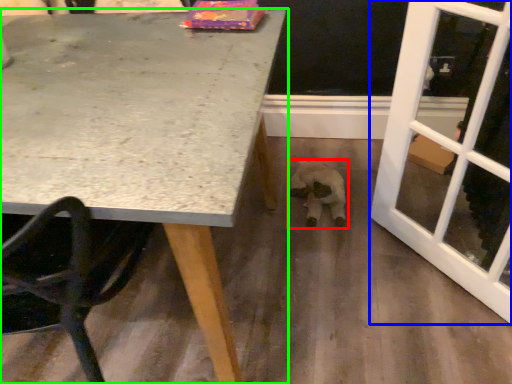
Question: Which object is positioned closest to animal (highlighted by a red box)? Select from screen door (highlighted by a blue box) and table (highlighted by a green box).

Choices:
 (A) screen door
 (B) table

Answer: (A)